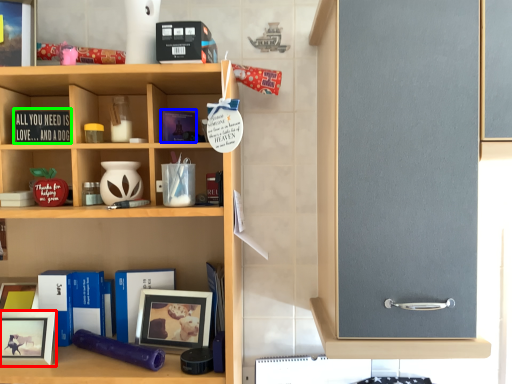
Question: Considering the real-world distances, which object is closest to picture frame (highlighted by a red box)? book (highlighted by a blue box) or book (highlighted by a green box).

Choices:
 (A) book
 (B) book

Answer: (B)